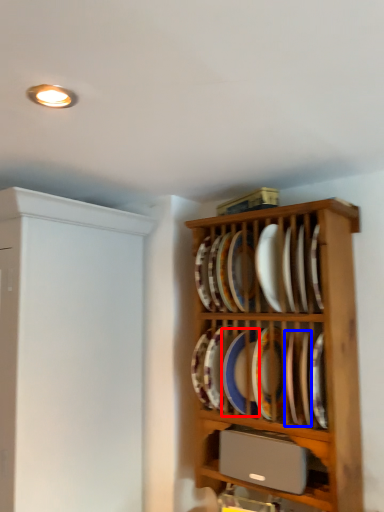
Question: Which object is further to the camera taking this photo, platter (highlighted by a red box) or platter (highlighted by a blue box)?

Choices:
 (A) platter
 (B) platter

Answer: (A)